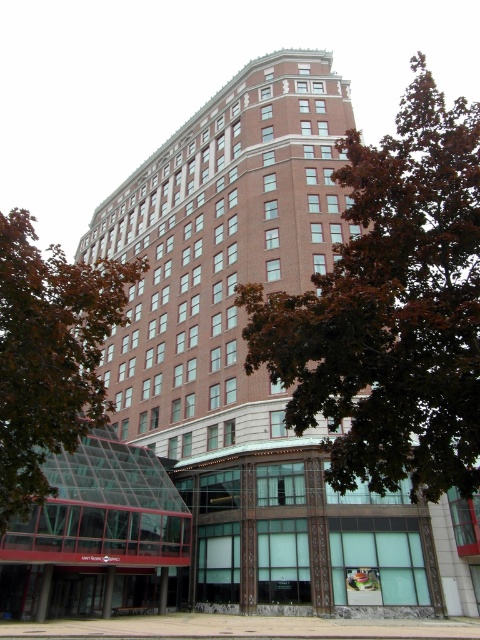
Question: Is brown leafy tree at upper center positioned behind green leafy tree at lower left?

Choices:
 (A) yes
 (B) no

Answer: (B)

Question: Does brown leafy tree at upper center appear on the right side of green leafy tree at lower left?

Choices:
 (A) yes
 (B) no

Answer: (A)

Question: Among these points, which one is nearest to the camera?

Choices:
 (A) (397, 161)
 (B) (127, 272)

Answer: (A)

Question: Can you confirm if brown leafy tree at upper center is thinner than green leafy tree at lower left?

Choices:
 (A) no
 (B) yes

Answer: (A)